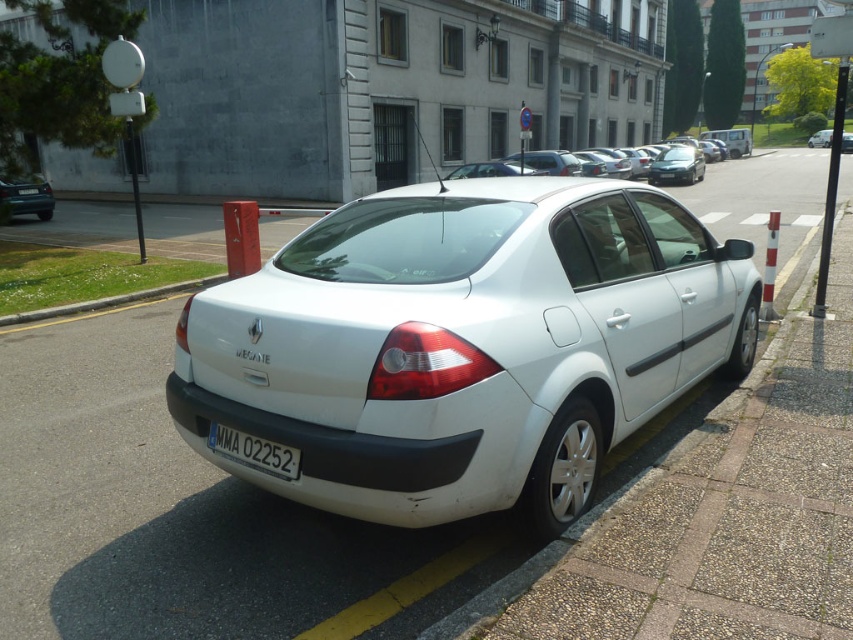
You are a parking attendant checking the alignment of two cars. You see a white matte sedan at center and a satin black sedan at center. Which one is positioned more to the right side of the parking spot?

The white matte sedan at center is positioned more to the right side of the parking spot compared to the satin black sedan at center, as it is located to the right of it.

You are standing on the sidewalk and looking at the white Renault M?gane parked diagonally on the street. There are two points marked on the car, one at coordinate point? (234, 435) and another at point? (47, 212). Which of these two points is closer to you?

Point? (234, 435) is closer to you than point? (47, 212).

You are a parking inspector checking if the black plastic license plate at lower center and the matte black car at left are positioned correctly according to parking regulations. Based on their spatial relationship, can you determine if the car is parked within the designated parking spot?

The black plastic license plate at lower center is to the right of the matte black car at left, which suggests that the car is not properly aligned within the designated parking spot as it is positioned diagonally across the parking lines. This misalignment indicates a potential violation of parking regulations.